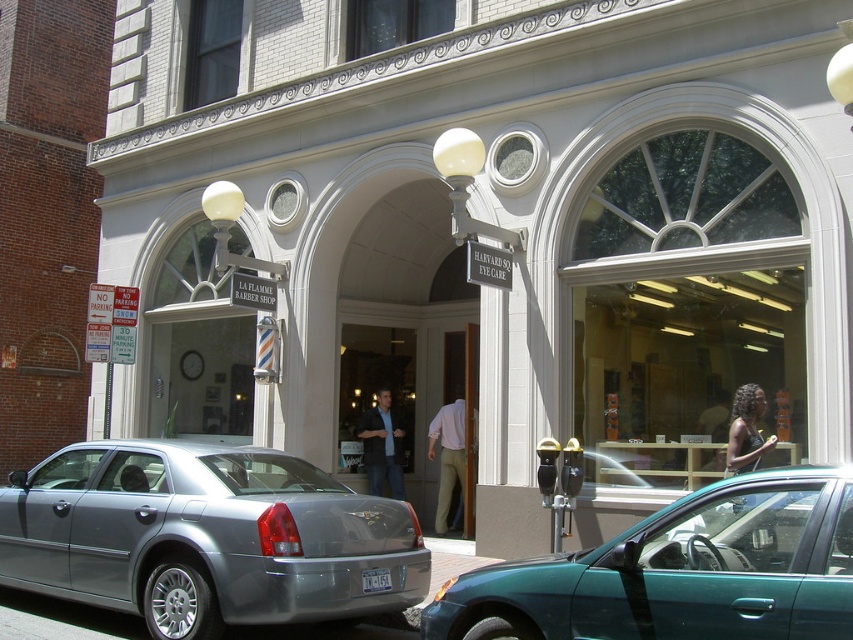
Question: Which object appears closest to the camera in this image?

Choices:
 (A) light brown wood door at center
 (B) gray asphalt at lower center
 (C) silver metallic sedan at lower left

Answer: (C)

Question: From the image, what is the correct spatial relationship of matte glass door at center in relation to light brown wood door at center?

Choices:
 (A) left
 (B) right

Answer: (A)

Question: Observing the image, what is the correct spatial positioning of silver metallic sedan at lower left in reference to gray asphalt at lower center?

Choices:
 (A) above
 (B) below

Answer: (A)

Question: Among these points, which one is nearest to the camera?

Choices:
 (A) (61, 634)
 (B) (469, 472)

Answer: (A)

Question: Can you confirm if matte glass door at center is positioned above gray asphalt at lower center?

Choices:
 (A) no
 (B) yes

Answer: (B)

Question: Which object is closer to the camera taking this photo?

Choices:
 (A) light brown wood door at center
 (B) gray asphalt at lower center
 (C) silver metallic sedan at lower left
 (D) teal glossy car at lower right

Answer: (D)